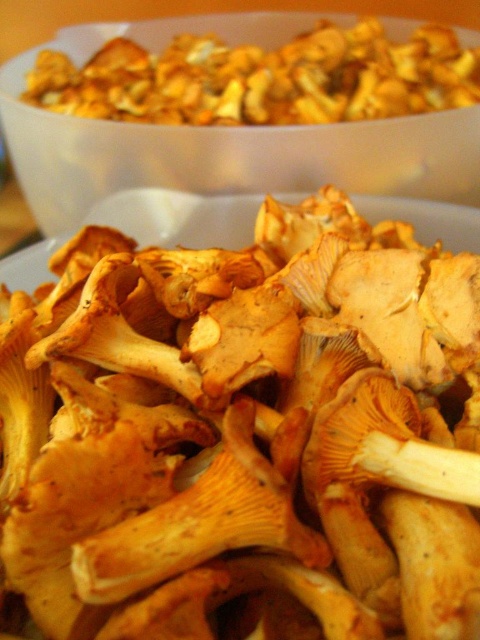
Which of these two, yellowish-brown textured mushrooms at center or yellowish-brown textured mushrooms at upper center, stands shorter?

yellowish-brown textured mushrooms at upper center

Is point (315, 348) farther from camera compared to point (170, 90)?

That is False.

Which is in front, point (335, 330) or point (107, 83)?

Point (335, 330) is more forward.

What are the coordinates of `yellowish-brown textured mushrooms at center` in the screenshot? It's located at (243, 435).

In the scene shown: Which is above, yellowish-brown textured mushrooms at center or translucent plastic bowl at upper center?

translucent plastic bowl at upper center is higher up.

Is point (17, 564) farther from viewer compared to point (191, 20)?

No, (17, 564) is closer to viewer.

Locate an element on the screen. yellowish-brown textured mushrooms at center is located at coordinates (243, 435).

Between point (394, 138) and point (175, 45), which one is positioned behind?

The point (175, 45) is more distant.

Does translucent plastic bowl at upper center have a larger size compared to yellowish-brown textured mushrooms at upper center?

Correct, translucent plastic bowl at upper center is larger in size than yellowish-brown textured mushrooms at upper center.

Between point (123, 26) and point (230, 113), which one is positioned behind?

The point (123, 26) is behind.

Where is `translucent plastic bowl at upper center`? This screenshot has height=640, width=480. translucent plastic bowl at upper center is located at coordinates (228, 156).